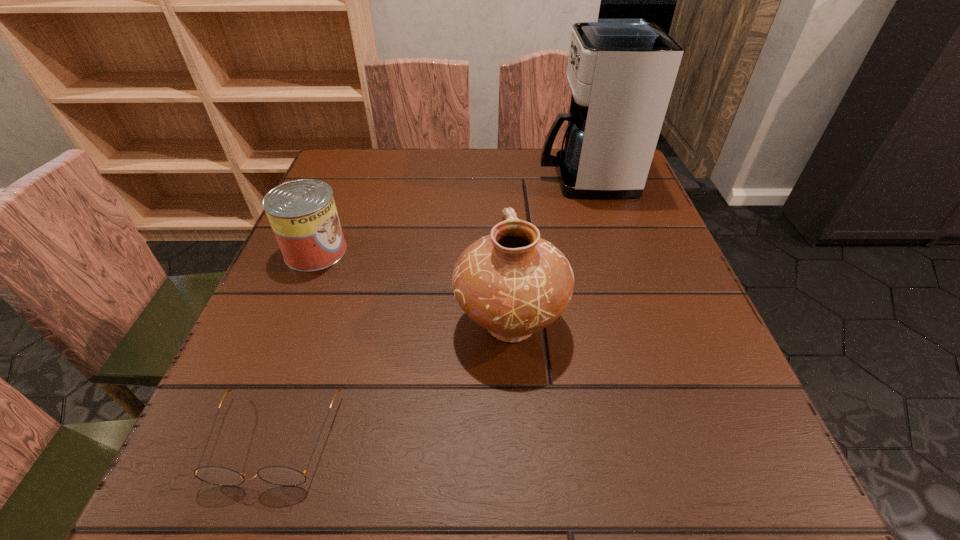
The width and height of the screenshot is (960, 540). Identify the location of object that is at the near left corner. (278, 475).

The image size is (960, 540). Identify the location of object at the far right corner. (621, 72).

Where is `vacant space at the far edge`? vacant space at the far edge is located at coordinates (405, 177).

In the image, there is a desktop. At what (x,y) coordinates should I click in order to perform the action: click on vacant space at the near edge. Please return your answer as a coordinate pair (x, y). The width and height of the screenshot is (960, 540). Looking at the image, I should click on (565, 451).

Find the location of a particular element. The image size is (960, 540). vacant area at the left edge of the desktop is located at coordinates (249, 375).

Locate an element on the screen. vacant space at the right edge of the desktop is located at coordinates (581, 203).

Find the location of a particular element. The width and height of the screenshot is (960, 540). vacant space at the far left corner of the desktop is located at coordinates (376, 153).

The image size is (960, 540). Identify the location of blank space at the near left corner. (271, 489).

At what (x,y) coordinates should I click in order to perform the action: click on free spot at the near right corner of the desktop. Please return your answer as a coordinate pair (x, y). Looking at the image, I should click on click(x=735, y=504).

Identify the location of free area in between the shortest object and the third shortest object. (393, 381).